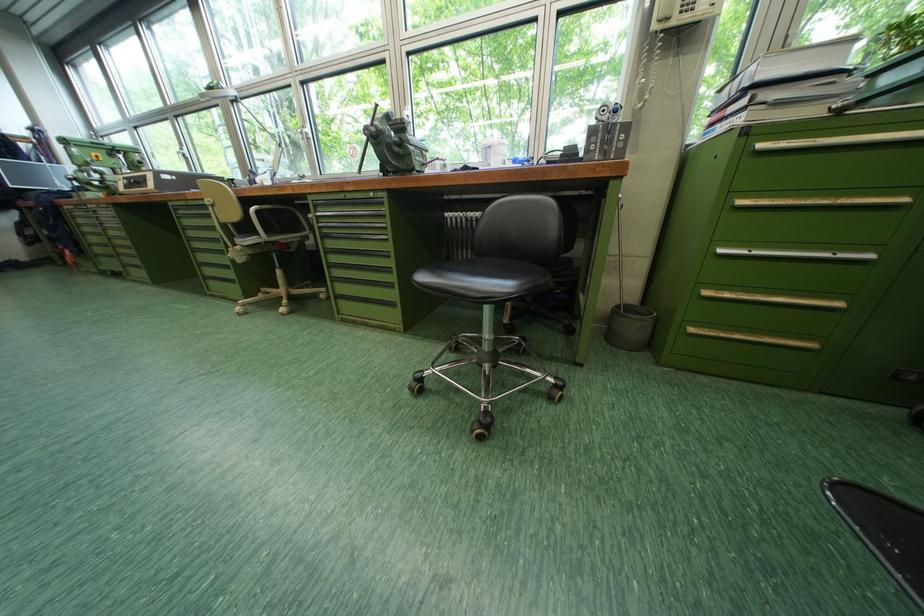
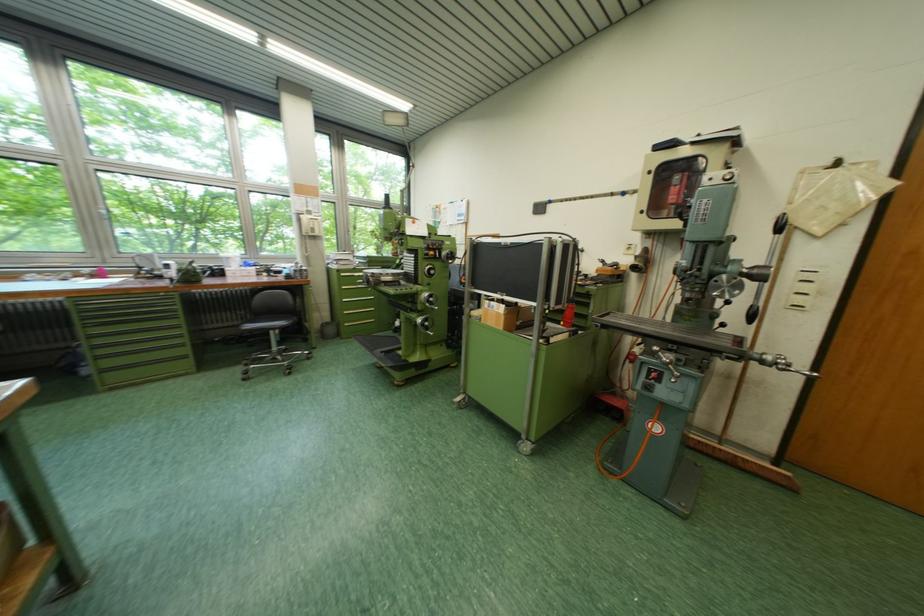
Find the pixel in the second image that matches pixel 849 307 in the first image.

(383, 312)